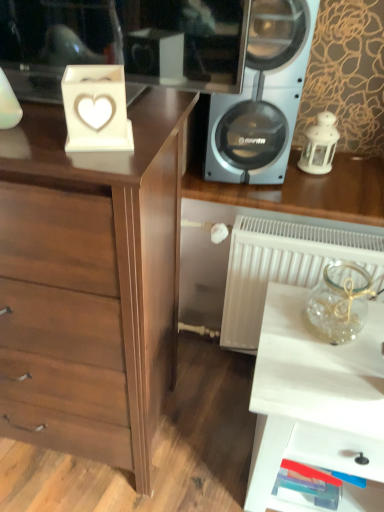
Question: Is white glossy table at lower right positioned behind silver metallic speaker at upper right?

Choices:
 (A) yes
 (B) no

Answer: (B)

Question: Is white glossy table at lower right not inside silver metallic speaker at upper right?

Choices:
 (A) no
 (B) yes

Answer: (B)

Question: Is white glossy table at lower right next to silver metallic speaker at upper right and touching it?

Choices:
 (A) yes
 (B) no

Answer: (B)

Question: Can you confirm if white glossy table at lower right is wider than silver metallic speaker at upper right?

Choices:
 (A) yes
 (B) no

Answer: (A)

Question: Does white glossy table at lower right come in front of silver metallic speaker at upper right?

Choices:
 (A) no
 (B) yes

Answer: (B)

Question: Looking at their shapes, would you say clear glass jar at right is wider or thinner than silver metallic speaker at upper right?

Choices:
 (A) wide
 (B) thin

Answer: (B)

Question: Considering the positions of point pyautogui.click(x=319, y=288) and point pyautogui.click(x=286, y=31), is point pyautogui.click(x=319, y=288) closer or farther from the camera than point pyautogui.click(x=286, y=31)?

Choices:
 (A) farther
 (B) closer

Answer: (A)

Question: From the image's perspective, relative to silver metallic speaker at upper right, is clear glass jar at right above or below?

Choices:
 (A) below
 (B) above

Answer: (A)

Question: Considering the positions of clear glass jar at right and silver metallic speaker at upper right in the image, is clear glass jar at right taller or shorter than silver metallic speaker at upper right?

Choices:
 (A) short
 (B) tall

Answer: (A)

Question: Is point (97, 248) closer or farther from the camera than point (317, 359)?

Choices:
 (A) closer
 (B) farther

Answer: (A)

Question: From a real-world perspective, is brown wood chest of drawers at left above or below white glossy table at lower right?

Choices:
 (A) above
 (B) below

Answer: (A)

Question: Do you think brown wood chest of drawers at left is within white glossy table at lower right, or outside of it?

Choices:
 (A) inside
 (B) outside

Answer: (B)

Question: Is brown wood chest of drawers at left taller or shorter than white glossy table at lower right?

Choices:
 (A) short
 (B) tall

Answer: (B)

Question: Is white porcelain lantern at right wider or thinner than brown wood chest of drawers at left?

Choices:
 (A) thin
 (B) wide

Answer: (A)

Question: Is white porcelain lantern at right bigger or smaller than brown wood chest of drawers at left?

Choices:
 (A) big
 (B) small

Answer: (B)